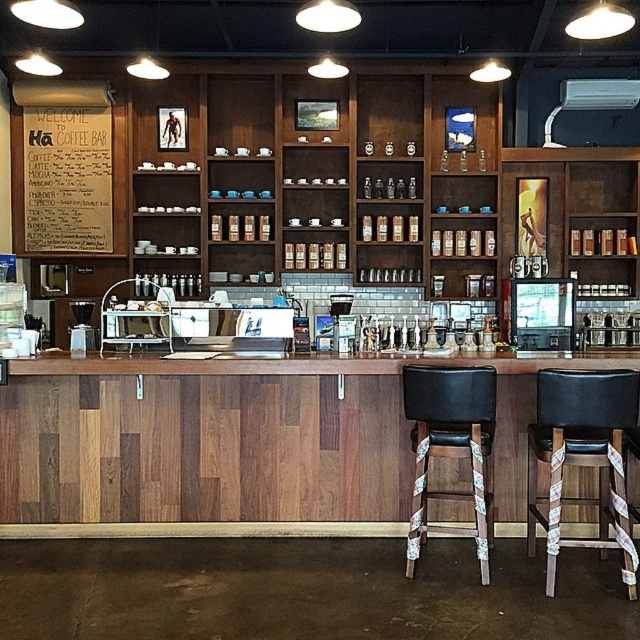
You are a customer entering the Ha Coffee Bar and want to sit at the black leather stool at center. Based on the coordinates provided, can you tell me the exact position of the stool in the image?

The black leather stool at center is located at coordinates point (451,448).

You are standing at the entrance of Ha Coffee Bar and want to sit on the black leather stool at right. Based on the coordinates provided, in which direction should you move relative to the entrance to reach it?

The black leather stool at right is located at coordinates point [582,458]. Since the coordinate system typically places the origin at the bottom left corner, moving towards the right and slightly upward from the entrance will lead you to the stool.

You are a customer at Ha Coffee Bar and want to place your order. You see two points on the counter where you can interact with the barista. One is at point [531,547] and the other at point [420,442]. Which point is closer to you?

Point [531,547] is further to the viewer than point [420,442], so the point at [420,442] is closer to you.